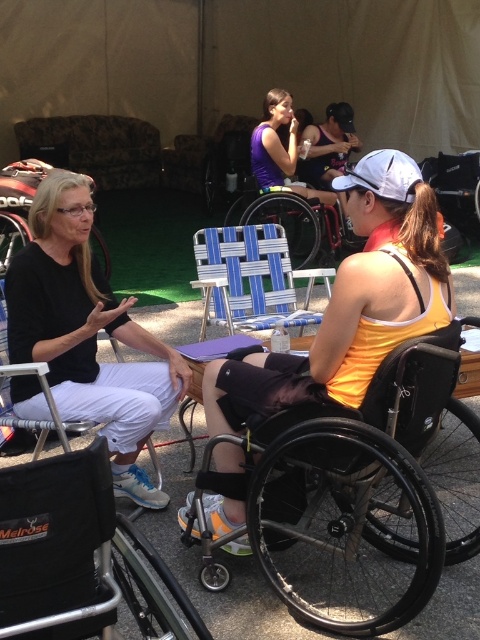
You are standing in the outdoor area and want to greet both the person in the matte black shirt at left and the person in the purple matte tank top at center. Which one should you approach first to reach them in the shortest distance?

You should approach the matte black shirt at left first because it is closer to you than the purple matte tank top at center, so you can reach them in the shortest distance.

You are a photographer trying to capture a group photo of the matte black shirt at left and the purple matte tank top at center. Since you want both subjects to be centered in the frame, which direction should you move the camera?

Since the matte black shirt at left is positioned on the left side of purple matte tank top at center, you should move the camera to the left to center both subjects in the frame.